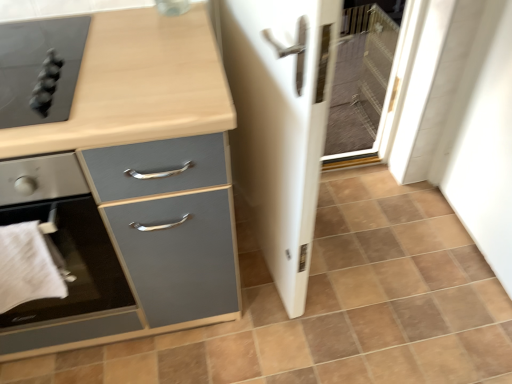
Question: Is point (379, 350) positioned closer to the camera than point (62, 261)?

Choices:
 (A) farther
 (B) closer

Answer: (A)

Question: Is brown matte tile at center inside or outside of white cloth at lower left?

Choices:
 (A) outside
 (B) inside

Answer: (A)

Question: Estimate the real-world distances between objects in this image. Which object is farther from the matte black cooktop at upper left, acting as the 1th home appliance starting from the top?

Choices:
 (A) matte black stove at left, the 1th home appliance in the bottom-to-top sequence
 (B) matte gray cabinet at left
 (C) white glossy screen door at center
 (D) brown matte tile at center
 (E) white cloth at lower left

Answer: (D)

Question: Which of these objects is positioned closest to the matte black cooktop at upper left, acting as the 1th home appliance starting from the top?

Choices:
 (A) matte black stove at left, which appears as the 2th home appliance when viewed from the top
 (B) white glossy screen door at center
 (C) white cloth at lower left
 (D) brown matte tile at center
 (E) matte gray cabinet at left

Answer: (E)